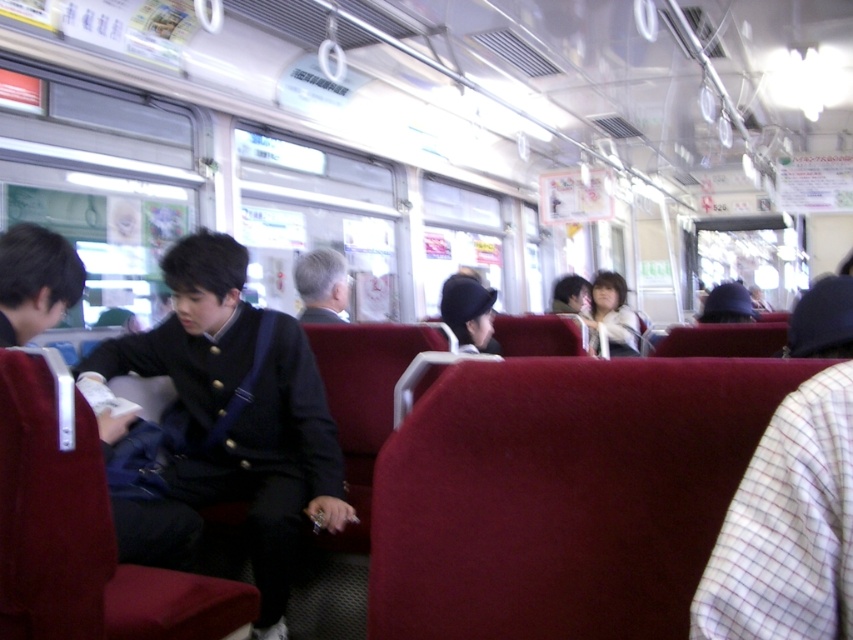
Question: Can you confirm if white checkered fabric at right is bigger than white fuzzy jacket at center?

Choices:
 (A) no
 (B) yes

Answer: (A)

Question: Which point is closer to the camera?

Choices:
 (A) [x=210, y=252]
 (B) [x=614, y=289]
 (C) [x=845, y=486]

Answer: (C)

Question: Which point appears closest to the camera in this image?

Choices:
 (A) (764, 611)
 (B) (166, 346)
 (C) (614, 344)

Answer: (A)

Question: Which of the following is the farthest from the observer?

Choices:
 (A) (614, 333)
 (B) (824, 480)

Answer: (A)

Question: Does matte black jacket at center have a larger size compared to white fuzzy jacket at center?

Choices:
 (A) no
 (B) yes

Answer: (B)

Question: Can you confirm if white checkered fabric at right is positioned to the left of white fuzzy jacket at center?

Choices:
 (A) yes
 (B) no

Answer: (A)